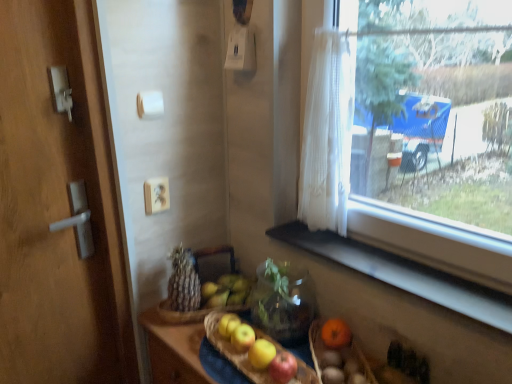
Image resolution: width=512 pixels, height=384 pixels. What are the coordinates of `free space above matte brown wicker basket at lower right, the second basket when ordered from left to right (from a real-world perspective)` in the screenshot? It's located at (330, 344).